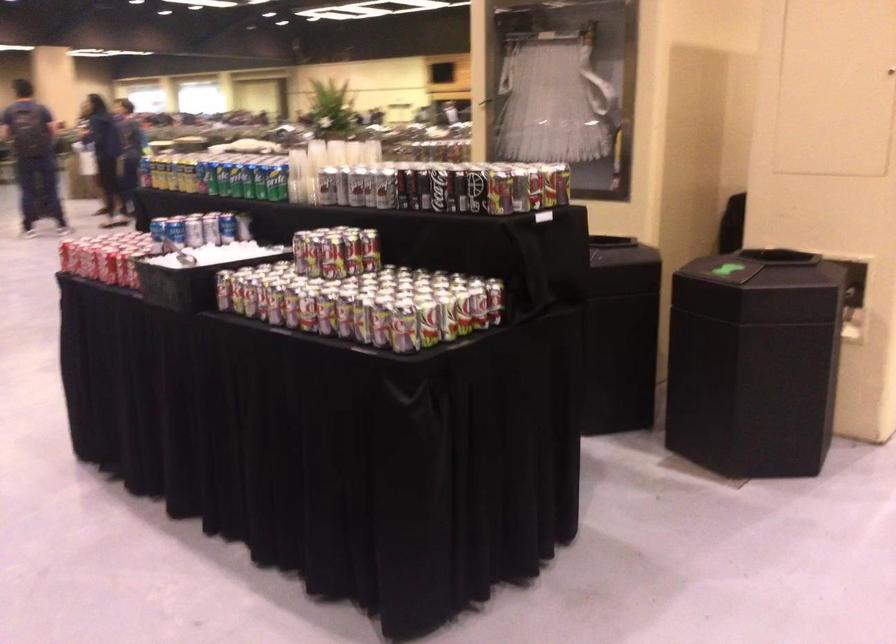
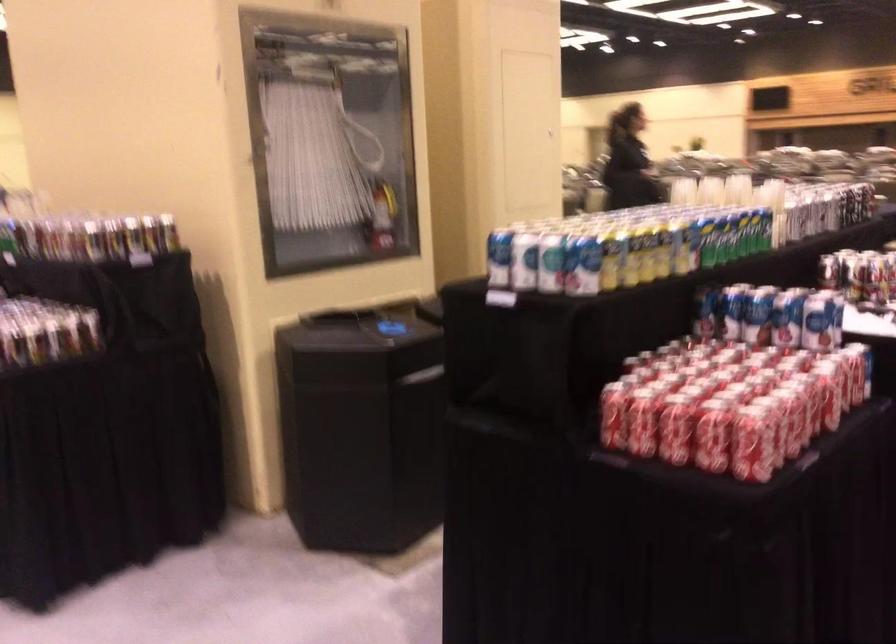
In the second image, find the point that corresponds to the point at 201,167 in the first image.

(703, 239)